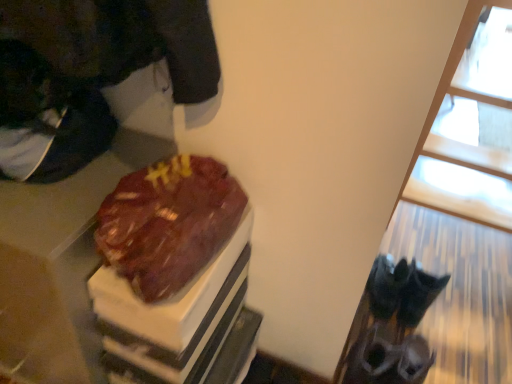
Question: In terms of height, does transparent glass window at upper right look taller or shorter compared to shiny chocolate cake at center?

Choices:
 (A) tall
 (B) short

Answer: (A)

Question: In the image, is transparent glass window at upper right positioned in front of or behind shiny chocolate cake at center?

Choices:
 (A) front
 (B) behind

Answer: (A)

Question: Is transparent glass window at upper right to the left or to the right of shiny chocolate cake at center in the image?

Choices:
 (A) right
 (B) left

Answer: (A)

Question: Visually, is shiny chocolate cake at center positioned to the left or to the right of transparent glass window at upper right?

Choices:
 (A) right
 (B) left

Answer: (B)

Question: From the image's perspective, is shiny chocolate cake at center located above or below transparent glass window at upper right?

Choices:
 (A) above
 (B) below

Answer: (B)

Question: Is point (164, 243) closer or farther from the camera than point (360, 327)?

Choices:
 (A) farther
 (B) closer

Answer: (B)

Question: In the image, is shiny chocolate cake at center positioned in front of or behind transparent glass window at upper right?

Choices:
 (A) front
 (B) behind

Answer: (B)